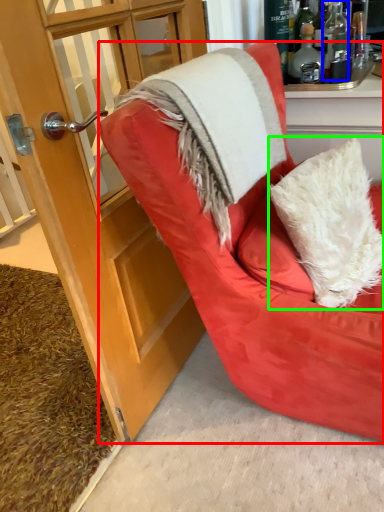
Question: Estimate the real-world distances between objects in this image. Which object is closer to chair (highlighted by a red box), bottle (highlighted by a blue box) or pillow (highlighted by a green box)?

Choices:
 (A) bottle
 (B) pillow

Answer: (B)